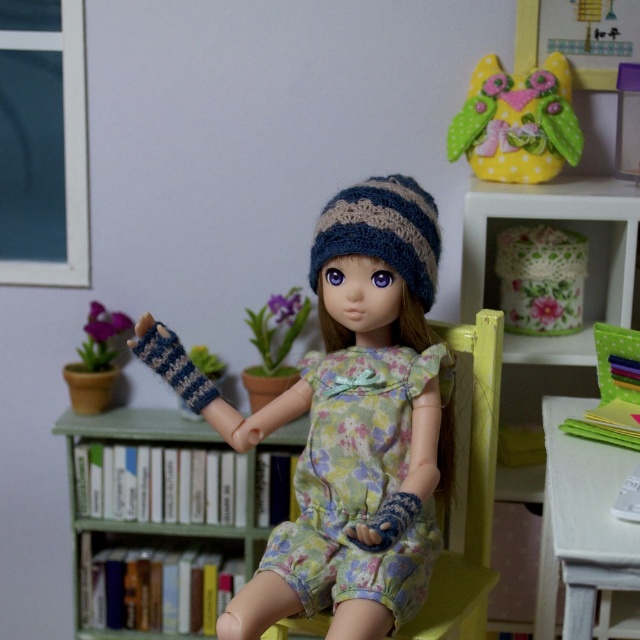
Question: Can you confirm if floral fabric basket at upper right is wider than yellow felt owl at upper right?

Choices:
 (A) no
 (B) yes

Answer: (B)

Question: Based on their relative distances, which object is farther from the blue knitted hat at center?

Choices:
 (A) floral fabric jar at upper right
 (B) purple fabric flower at left

Answer: (B)

Question: Is the position of knitted fingerless gloves at center more distant than that of floral fabric jar at upper right?

Choices:
 (A) no
 (B) yes

Answer: (A)

Question: Which object is farther from the camera taking this photo?

Choices:
 (A) floral fabric basket at upper right
 (B) yellow felt owl at upper right
 (C) floral cotton dress at center
 (D) purple fabric flower at left

Answer: (D)

Question: Is knitted fingerless gloves at center positioned before floral fabric basket at upper right?

Choices:
 (A) yes
 (B) no

Answer: (A)

Question: Which of the following is the closest to the observer?

Choices:
 (A) click(493, 148)
 (B) click(417, 541)
 (C) click(410, 353)

Answer: (B)